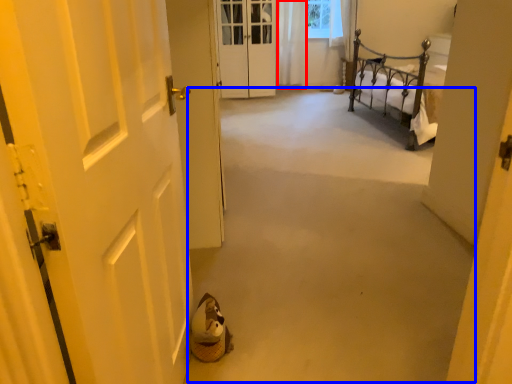
Question: Which point is further to the camera, curtain (highlighted by a red box) or corridor (highlighted by a blue box)?

Choices:
 (A) curtain
 (B) corridor

Answer: (A)